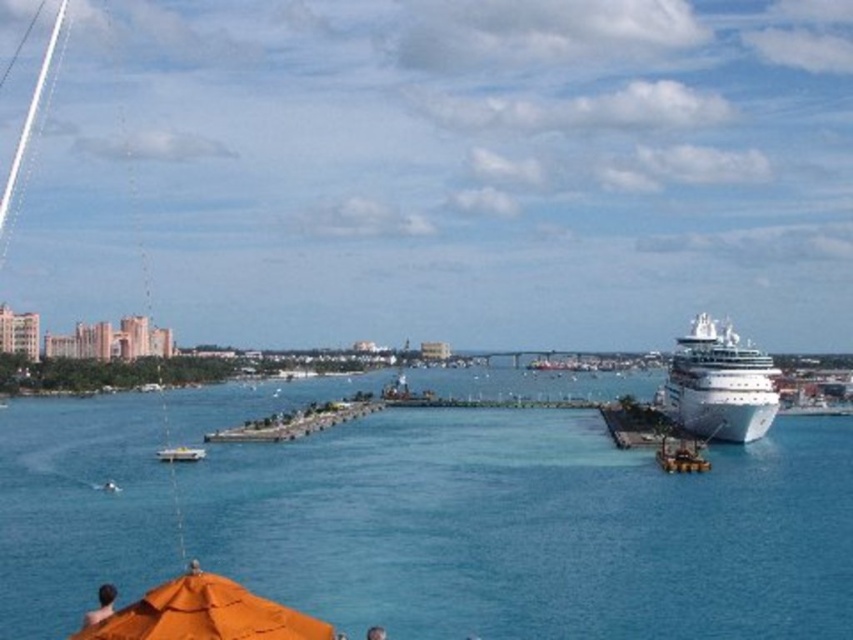
Question: Is white glossy cruise ship at right to the left of concrete pier at center from the viewer's perspective?

Choices:
 (A) yes
 (B) no

Answer: (B)

Question: Considering the relative positions of concrete pier at center and light brown skin at lower left in the image provided, where is concrete pier at center located with respect to light brown skin at lower left?

Choices:
 (A) right
 (B) left

Answer: (B)

Question: Considering the real-world distances, which object is closest to the smooth skin head at lower center?

Choices:
 (A) white plastic boat at lower left
 (B) white concrete dock at right
 (C) white glossy cruise ship at right

Answer: (A)

Question: Is blue water at center positioned in front of smooth skin head at lower center?

Choices:
 (A) yes
 (B) no

Answer: (B)

Question: Which object appears closest to the camera in this image?

Choices:
 (A) smooth skin head at lower center
 (B) orange fabric umbrella at lower left
 (C) light brown skin at lower left
 (D) white glossy cruise ship at right

Answer: (B)

Question: Which point is farther to the camera?

Choices:
 (A) white glossy cruise ship at right
 (B) blue water at center
 (C) smooth skin head at lower center
 (D) white plastic boat at lower left

Answer: (A)